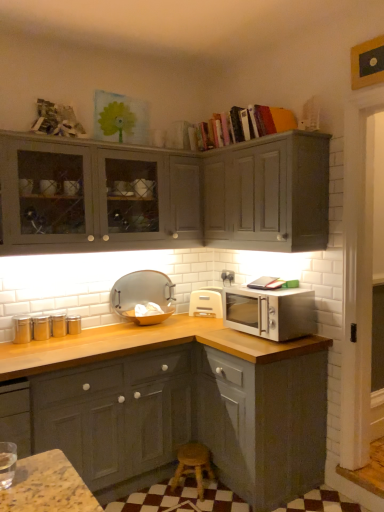
Find the location of a particular element. vacant area that is in front of wooden at lower center is located at coordinates (199, 503).